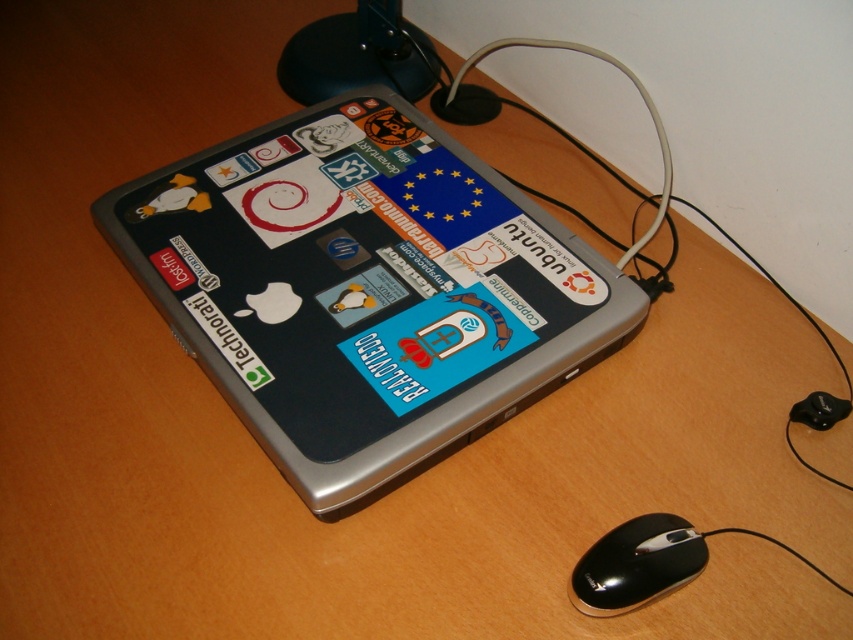
You are a delivery person who needs to place a small package on the desk without blocking the silver metallic laptop at center or the black plastic mouse at lower right. The package is 12 inches long. Can you fit it between them?

The silver metallic laptop at center is 18.76 inches away from the black plastic mouse at lower right. Since the package is 12 inches long, which is shorter than the distance between them, you can place the package between the silver metallic laptop at center and the black plastic mouse at lower right without blocking them.

You are a technician trying to connect a new cable to the laptop. You see two points on the laptop labeled as point (306, 476) and point (663, 516). Which point is closer to you?

Point (306, 476) is closer to you because it is further to the viewer than point (663, 516).